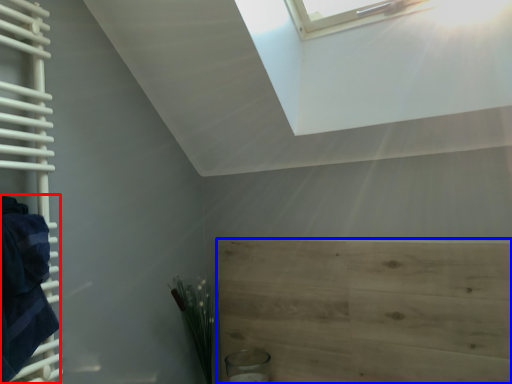
Question: Which object appears farthest to the camera in this image, blanket (highlighted by a red box) or plywood (highlighted by a blue box)?

Choices:
 (A) blanket
 (B) plywood

Answer: (B)